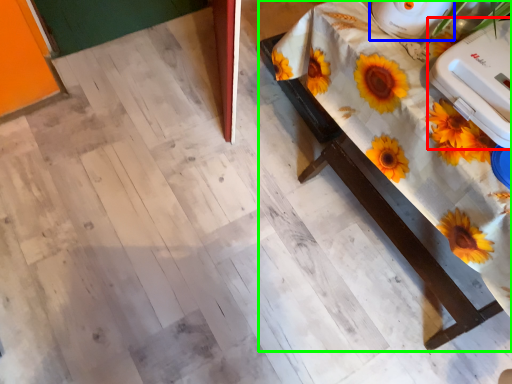
Question: Considering the real-world distances, which object is farthest from appliance (highlighted by a red box)? appliance (highlighted by a blue box) or table (highlighted by a green box)?

Choices:
 (A) appliance
 (B) table

Answer: (B)